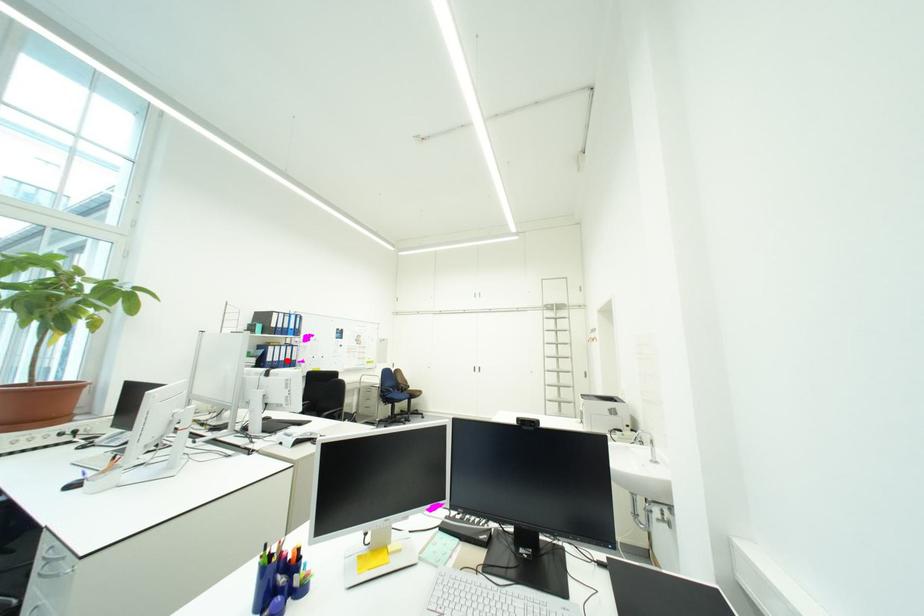
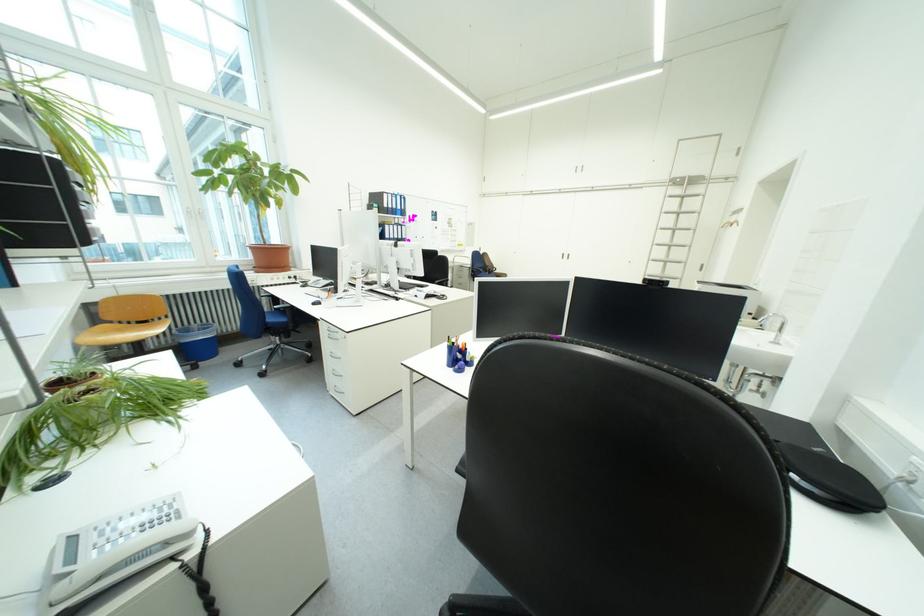
Question: A red point is marked in image1. In image2, is the corresponding 3D point closer to the camera or farther? Reply with the corresponding letter.

Choices:
 (A) The corresponding 3D point is closer.
 (B) The corresponding 3D point is farther.

Answer: (A)